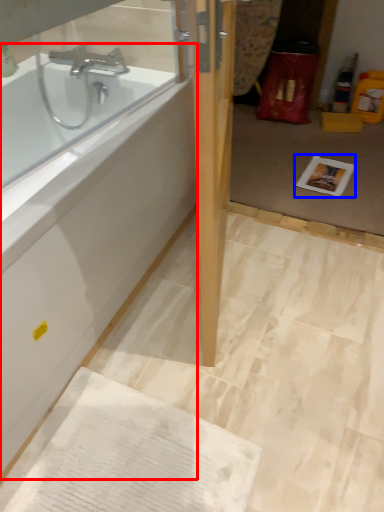
Question: Which point is closer to the camera, bathtub (highlighted by a red box) or copy (highlighted by a blue box)?

Choices:
 (A) bathtub
 (B) copy

Answer: (A)